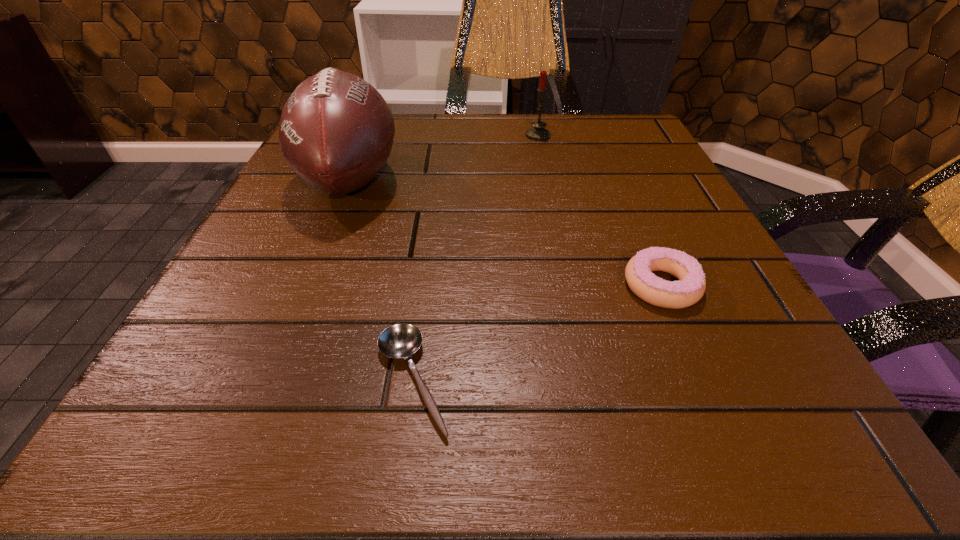
Locate an element on the screen. This screenshot has width=960, height=540. free space between the second tallest object and the shortest object is located at coordinates (475, 258).

You are a GUI agent. You are given a task and a screenshot of the screen. Output one action in this format:
    pyautogui.click(x=<x>, y=<y>)
    Task: Click on the vacant area that lies between the ladle and the leftmost object
    The image size is (960, 540).
    Given the screenshot: What is the action you would take?
    pyautogui.click(x=381, y=280)

At what (x,y) coordinates should I click in order to perform the action: click on empty space between the football (American) and the doughnut. Please return your answer as a coordinate pair (x, y). The height and width of the screenshot is (540, 960). Looking at the image, I should click on (506, 233).

Image resolution: width=960 pixels, height=540 pixels. Identify the location of empty space that is in between the rightmost object and the nearest object. (537, 333).

Choose which object is the nearest neighbor to the shortest object. Please provide its 2D coordinates. Your answer should be formatted as a tuple, i.e. [(x, y)], where the tuple contains the x and y coordinates of a point satisfying the conditions above.

[(336, 131)]

The image size is (960, 540). Identify the location of the closest object to the ladle. (336, 131).

Locate an element on the screen. The width and height of the screenshot is (960, 540). vacant space that satisfies the following two spatial constraints: 1. on the back side of the tallest object; 2. on the right side of the third object from left to right is located at coordinates (369, 136).

Locate an element on the screen. The height and width of the screenshot is (540, 960). vacant space that satisfies the following two spatial constraints: 1. on the back side of the ladle; 2. on the left side of the third farthest object is located at coordinates (425, 286).

This screenshot has height=540, width=960. In order to click on blank area in the image that satisfies the following two spatial constraints: 1. on the front side of the third farthest object; 2. on the left side of the tallest object in this screenshot , I will do `click(306, 286)`.

Locate an element on the screen. vacant space that satisfies the following two spatial constraints: 1. on the front side of the third nearest object; 2. on the right side of the second shortest object is located at coordinates (306, 286).